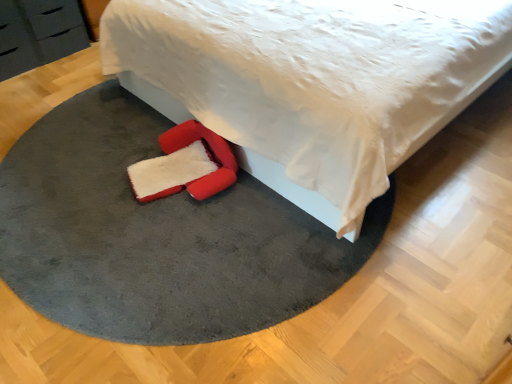
I want to click on free space in front of matte black dresser at upper left, so click(x=45, y=77).